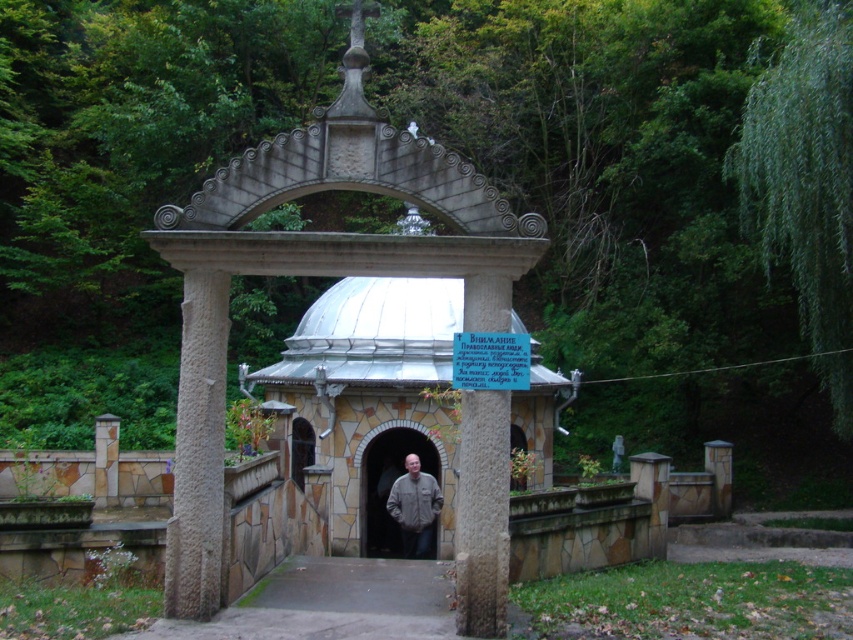
Question: Where is stone archway at center located in relation to gray fabric jacket at center in the image?

Choices:
 (A) left
 (B) right

Answer: (A)

Question: Can you confirm if gray stone pillar at center is smaller than stone archway at center?

Choices:
 (A) yes
 (B) no

Answer: (A)

Question: Which of the following is the closest to the observer?

Choices:
 (A) gray stone pillar at center
 (B) gray fabric jacket at center

Answer: (A)

Question: Among these points, which one is farthest from the camera?

Choices:
 (A) (376, 467)
 (B) (492, 612)
 (C) (419, 460)

Answer: (A)

Question: Can you confirm if gray stone pillar at center is wider than gray fabric jacket at center?

Choices:
 (A) no
 (B) yes

Answer: (A)

Question: Which object is closer to the camera taking this photo?

Choices:
 (A) stone archway at center
 (B) gray fabric jacket at center

Answer: (B)